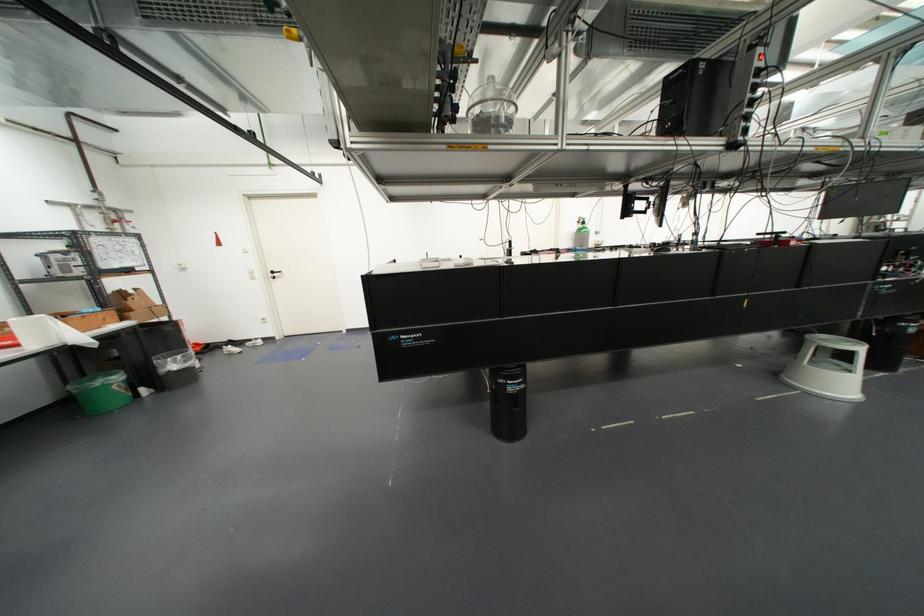
The width and height of the screenshot is (924, 616). I want to click on red power switch, so 216,238.